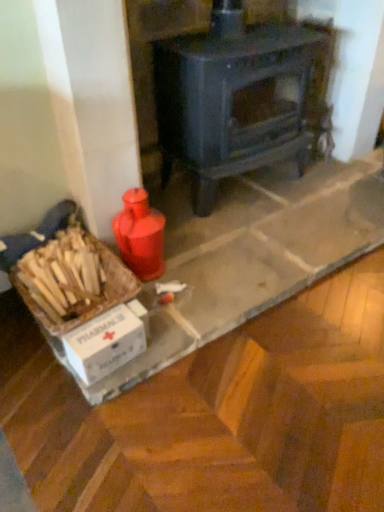
Question: Can you confirm if matte black wood burning stove at center is positioned to the right of white cardboard box at lower left?

Choices:
 (A) no
 (B) yes

Answer: (B)

Question: Does matte black wood burning stove at center have a greater height compared to white cardboard box at lower left?

Choices:
 (A) no
 (B) yes

Answer: (B)

Question: From a real-world perspective, does matte black wood burning stove at center stand above white cardboard box at lower left?

Choices:
 (A) no
 (B) yes

Answer: (B)

Question: Can you confirm if matte black wood burning stove at center is smaller than white cardboard box at lower left?

Choices:
 (A) yes
 (B) no

Answer: (B)

Question: Does matte black wood burning stove at center come in front of white cardboard box at lower left?

Choices:
 (A) yes
 (B) no

Answer: (B)

Question: Can we say matte black wood burning stove at center lies outside white cardboard box at lower left?

Choices:
 (A) yes
 (B) no

Answer: (A)

Question: Does matte black wood burning stove at center have a larger size compared to white cardboard box at lower left?

Choices:
 (A) no
 (B) yes

Answer: (B)

Question: Is matte black wood burning stove at center completely or partially outside of white cardboard box at lower left?

Choices:
 (A) yes
 (B) no

Answer: (A)

Question: Is matte black wood burning stove at center at the right side of white cardboard box at lower left?

Choices:
 (A) no
 (B) yes

Answer: (B)

Question: Could you tell me if matte black wood burning stove at center is turned towards white cardboard box at lower left?

Choices:
 (A) yes
 (B) no

Answer: (B)

Question: Does matte black wood burning stove at center have a lesser height compared to white cardboard box at lower left?

Choices:
 (A) yes
 (B) no

Answer: (B)

Question: Does matte black wood burning stove at center have a greater height compared to white cardboard box at lower left?

Choices:
 (A) yes
 (B) no

Answer: (A)

Question: Is white cardboard box at lower left in contact with matte black wood burning stove at center?

Choices:
 (A) yes
 (B) no

Answer: (B)